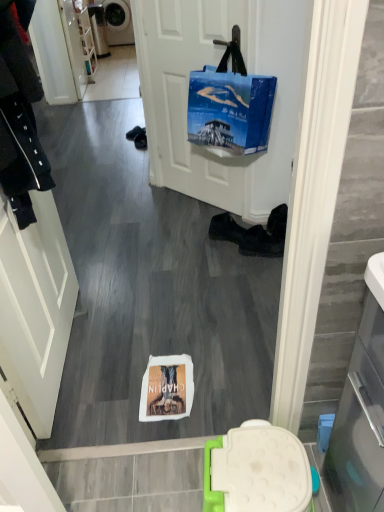
What are the coordinates of `vacant space that's between white matte door at center and white glossy door at left` in the screenshot? It's located at (136, 263).